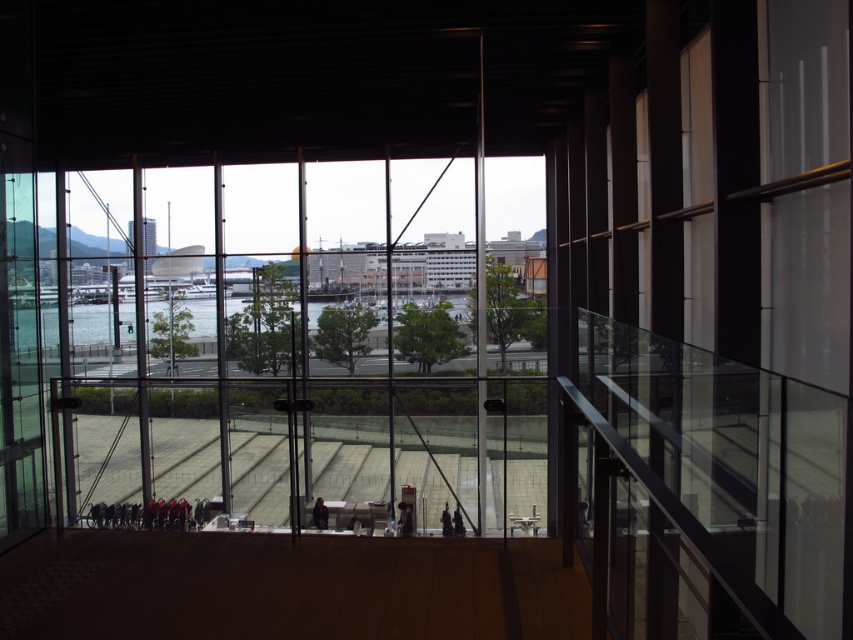
Question: Is transparent glass window at center to the right of clear water at center from the viewer's perspective?

Choices:
 (A) no
 (B) yes

Answer: (B)

Question: Which object is farther from the camera taking this photo?

Choices:
 (A) transparent glass window at center
 (B) clear water at center

Answer: (B)

Question: Is transparent glass window at center wider than clear water at center?

Choices:
 (A) no
 (B) yes

Answer: (B)

Question: Which point appears farthest from the camera in this image?

Choices:
 (A) (158, 305)
 (B) (312, 276)

Answer: (A)

Question: Is transparent glass window at center wider than clear water at center?

Choices:
 (A) yes
 (B) no

Answer: (A)